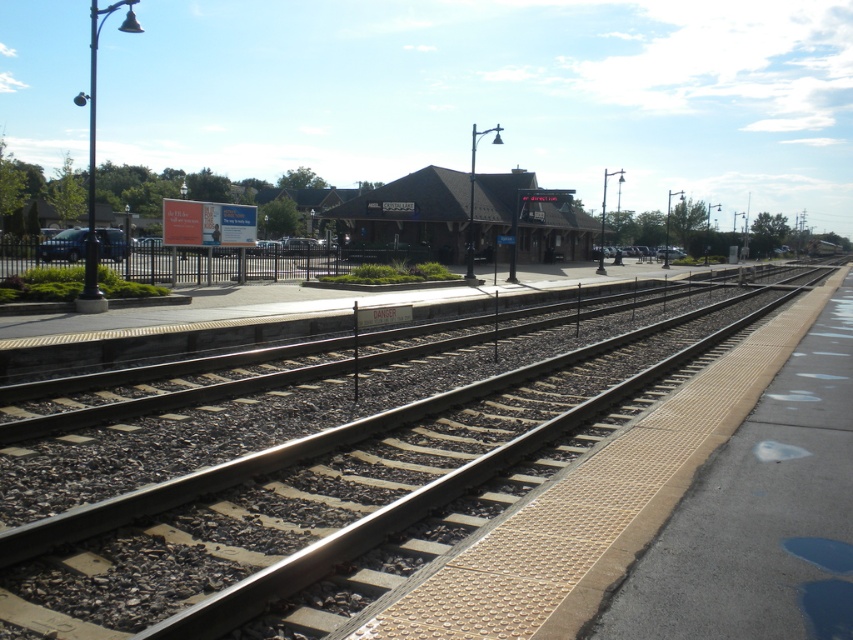
Question: Does smooth asphalt track at center have a lesser width compared to brown wooden railway station at center?

Choices:
 (A) yes
 (B) no

Answer: (A)

Question: Does smooth asphalt track at center appear under brown wooden railway station at center?

Choices:
 (A) no
 (B) yes

Answer: (B)

Question: Which of the following is the closest to the observer?

Choices:
 (A) brown wooden railway station at center
 (B) smooth asphalt track at center

Answer: (B)

Question: Which point is farther to the camera?

Choices:
 (A) smooth asphalt track at center
 (B) brown wooden railway station at center

Answer: (B)

Question: Is smooth asphalt track at center wider than brown wooden railway station at center?

Choices:
 (A) yes
 (B) no

Answer: (B)